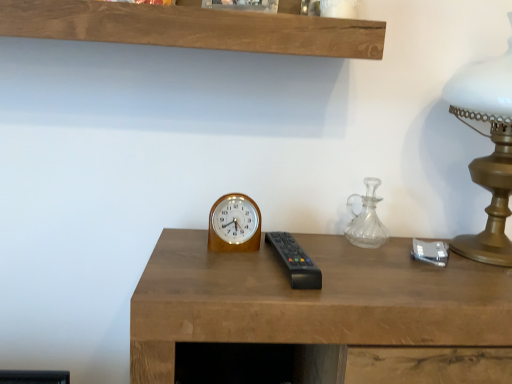
In order to face gold metallic table lamp at right, should I rotate leftwards or rightwards?

To face it directly, rotate right by 31.466 degrees.

Measure the distance between black plastic remote at center and camera.

black plastic remote at center and camera are 24.72 inches apart from each other.

The image size is (512, 384). What do you see at coordinates (366, 219) in the screenshot?
I see `clear glass carafe at right` at bounding box center [366, 219].

In order to click on gold metallic table lamp at right in this screenshot , I will do point(489,155).

Does wooden wall clock at center turn towards clear glass carafe at right?

No, wooden wall clock at center does not turn towards clear glass carafe at right.

From the image's perspective, which object appears higher, wooden wall clock at center or clear glass carafe at right?

clear glass carafe at right is shown above in the image.

Can you see wooden wall clock at center touching clear glass carafe at right?

No, wooden wall clock at center is not with clear glass carafe at right.

From a real-world perspective, is wooden wall clock at center above or below clear glass carafe at right?

wooden wall clock at center is below clear glass carafe at right.

Between gold metallic table lamp at right and clear glass carafe at right, which one appears on the right side from the viewer's perspective?

Positioned to the right is gold metallic table lamp at right.

Image resolution: width=512 pixels, height=384 pixels. I want to click on table lamp above the clear glass carafe at right (from the image's perspective), so click(x=489, y=155).

From the image's perspective, between gold metallic table lamp at right and clear glass carafe at right, which one is located above?

gold metallic table lamp at right appears higher in the image.

Measure the distance from gold metallic table lamp at right to clear glass carafe at right.

8.95 inches.

From the image's perspective, is wooden desk at center beneath wooden wall clock at center?

Yes.

From a real-world perspective, is wooden desk at center above or below wooden wall clock at center?

Clearly, from a real-world perspective, wooden desk at center is below wooden wall clock at center.

Between wooden desk at center and wooden wall clock at center, which one is positioned behind?

wooden wall clock at center is behind.

Is clear glass carafe at right not within gold metallic table lamp at right?

clear glass carafe at right lies outside gold metallic table lamp at right's area.

Consider the image. From their relative heights in the image, would you say clear glass carafe at right is taller or shorter than gold metallic table lamp at right?

Considering their sizes, clear glass carafe at right has less height than gold metallic table lamp at right.

Could you tell me if clear glass carafe at right is facing gold metallic table lamp at right?

No, clear glass carafe at right is not turned towards gold metallic table lamp at right.

Is clear glass carafe at right closer to the viewer compared to gold metallic table lamp at right?

No, clear glass carafe at right is further to the viewer.

Which object is positioned more to the left, clear glass carafe at right or black plastic remote at center?

black plastic remote at center is more to the left.

Is point (349, 226) positioned behind point (308, 276)?

Yes, point (349, 226) is behind point (308, 276).

Based on their sizes in the image, would you say clear glass carafe at right is bigger or smaller than black plastic remote at center?

Considering their sizes, clear glass carafe at right takes up more space than black plastic remote at center.

Does clear glass carafe at right come in front of black plastic remote at center?

No, it is behind black plastic remote at center.

Is the surface of gold metallic table lamp at right in direct contact with wooden wall clock at center?

No.

Where is `table lamp on the right side of wooden wall clock at center`? The image size is (512, 384). table lamp on the right side of wooden wall clock at center is located at coordinates (489, 155).

Between gold metallic table lamp at right and wooden wall clock at center, which one has more height?

With more height is gold metallic table lamp at right.

Considering the relative positions of gold metallic table lamp at right and wooden wall clock at center in the image provided, is gold metallic table lamp at right to the left or to the right of wooden wall clock at center?

Based on their positions, gold metallic table lamp at right is located to the right of wooden wall clock at center.

Considering the positions of objects gold metallic table lamp at right and wooden desk at center in the image provided, who is more to the right, gold metallic table lamp at right or wooden desk at center?

gold metallic table lamp at right is more to the right.

Which of these two, gold metallic table lamp at right or wooden desk at center, stands shorter?

wooden desk at center is shorter.

From the image's perspective, is gold metallic table lamp at right above or below wooden desk at center?

Based on their image positions, gold metallic table lamp at right is located above wooden desk at center.

Where is `glass vase above the wooden wall clock at center (from the image's perspective)`? This screenshot has width=512, height=384. glass vase above the wooden wall clock at center (from the image's perspective) is located at coordinates (366, 219).

Locate an element on the screen. table lamp above the clear glass carafe at right (from a real-world perspective) is located at coordinates (489, 155).

Considering their positions, is clear glass carafe at right positioned closer to wooden wall clock at center than black plastic remote at center?

Based on the image, black plastic remote at center appears to be nearer to wooden wall clock at center.

Based on their spatial positions, is black plastic remote at center or wooden desk at center further from wooden wall clock at center?

Among the two, wooden desk at center is located further to wooden wall clock at center.

Which object lies further to the anchor point gold metallic table lamp at right, black plastic remote at center or wooden desk at center?

black plastic remote at center is positioned further to the anchor gold metallic table lamp at right.

Based on the photo, based on their spatial positions, is wooden desk at center or wooden wall clock at center closer to clear glass carafe at right?

wooden desk at center is positioned closer to the anchor clear glass carafe at right.

Based on the photo, looking at the image, which one is located further to black plastic remote at center, gold metallic table lamp at right or clear glass carafe at right?

gold metallic table lamp at right is further to black plastic remote at center.

Considering their positions, is gold metallic table lamp at right positioned closer to wooden desk at center than black plastic remote at center?

Among the two, black plastic remote at center is located nearer to wooden desk at center.

Based on their spatial positions, is gold metallic table lamp at right or black plastic remote at center closer to wooden wall clock at center?

Among the two, black plastic remote at center is located nearer to wooden wall clock at center.

Based on their spatial positions, is black plastic remote at center or wooden wall clock at center further from clear glass carafe at right?

Among the two, wooden wall clock at center is located further to clear glass carafe at right.

Find the location of a particular element. The image size is (512, 384). wall clock located between wooden desk at center and clear glass carafe at right in the depth direction is located at coordinates (234, 224).

The height and width of the screenshot is (384, 512). Find the location of `control between wooden desk at center and clear glass carafe at right in the front-back direction`. control between wooden desk at center and clear glass carafe at right in the front-back direction is located at coordinates (295, 261).

This screenshot has height=384, width=512. What are the coordinates of `control between wooden wall clock at center and gold metallic table lamp at right` in the screenshot? It's located at (295, 261).

Find the location of a particular element. The width and height of the screenshot is (512, 384). glass vase situated between wooden wall clock at center and gold metallic table lamp at right from left to right is located at coordinates (366, 219).